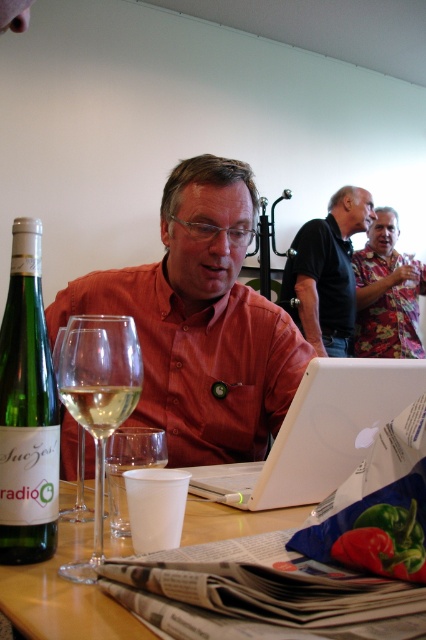
Question: In this image, where is matte orange shirt at center located relative to clear glass wine glass at table center?

Choices:
 (A) left
 (B) right

Answer: (B)

Question: From the image, what is the correct spatial relationship of clear glass wine glass at left in relation to dark blue shirt at center?

Choices:
 (A) below
 (B) above

Answer: (A)

Question: Which object appears closest to the camera in this image?

Choices:
 (A) floral fabric shirt at upper right
 (B) clear glass wine glass at table center

Answer: (B)

Question: Is dark blue shirt at center to the right of white translucent glass at center from the viewer's perspective?

Choices:
 (A) no
 (B) yes

Answer: (B)

Question: Which point is closer to the camera?

Choices:
 (A) (5, 346)
 (B) (124, 529)

Answer: (A)

Question: Which of these objects is positioned closest to the matte orange shirt at center?

Choices:
 (A) wooden table at center
 (B) clear glass wine glass at table center
 (C) green glass bottle at left

Answer: (B)